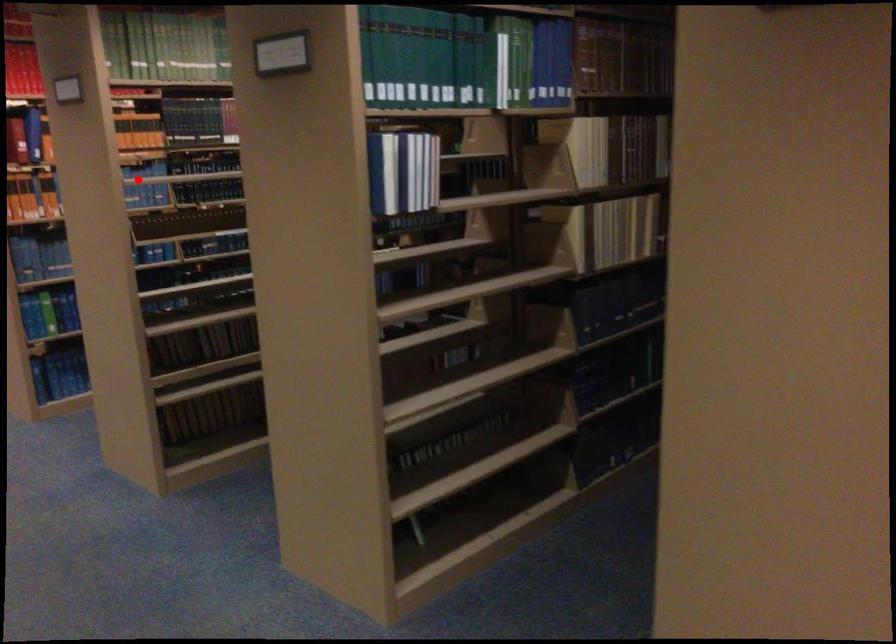
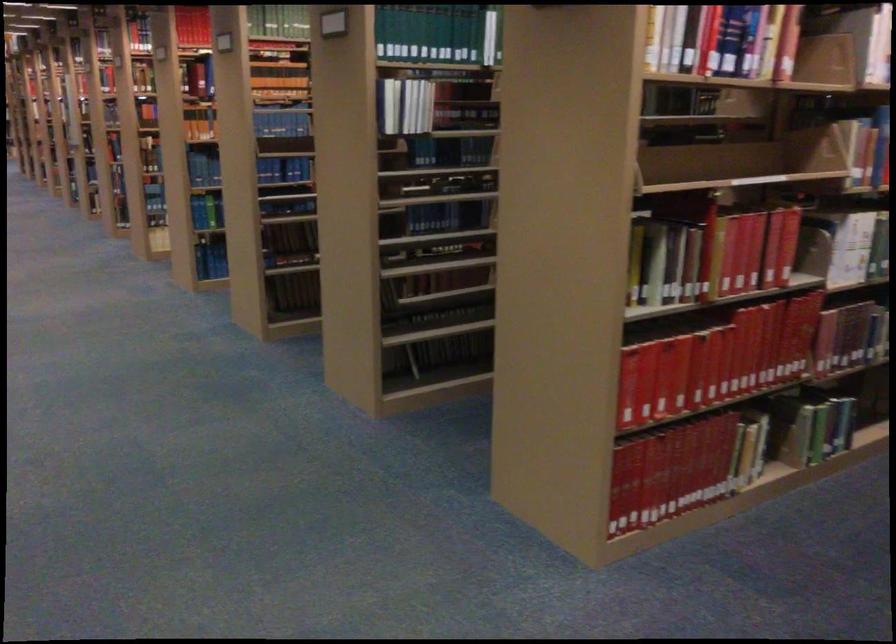
Question: I am providing you with two images of the same scene from different viewpoints. In image1, a red point is highlighted. Considering the same 3D point in image2, which of the following is correct?

Choices:
 (A) It is closer
 (B) It is farther

Answer: (B)